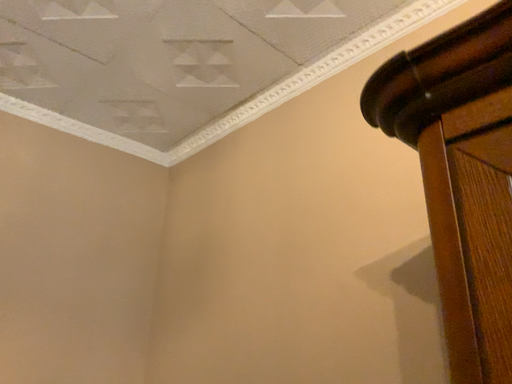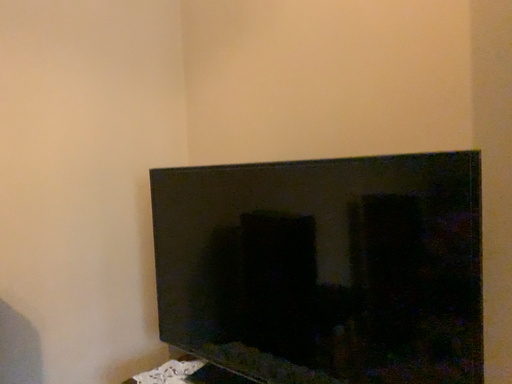
Question: How did the camera likely rotate when shooting the video?

Choices:
 (A) rotated downward
 (B) rotated upward

Answer: (A)